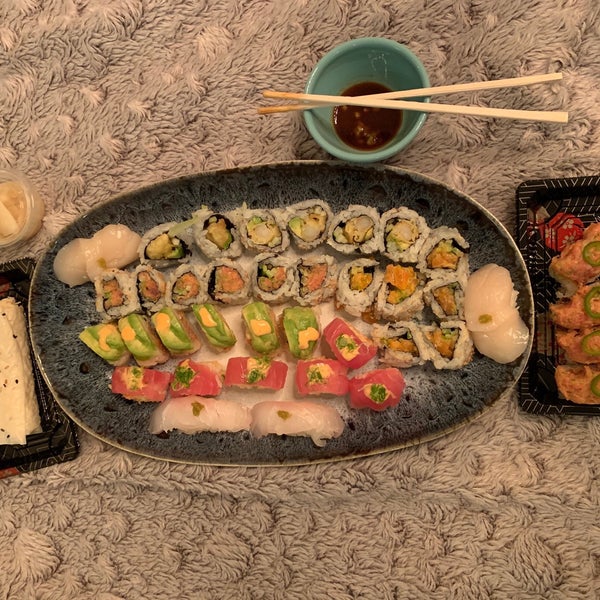
The image size is (600, 600). In order to click on rug in this screenshot , I will do `click(374, 554)`.